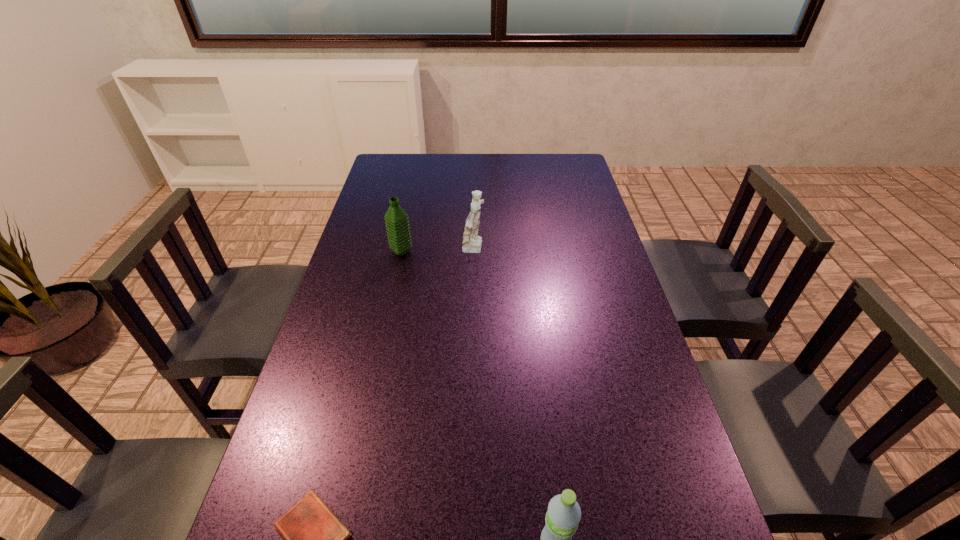
You are a GUI agent. You are given a task and a screenshot of the screen. Output one action in this format:
    pyautogui.click(x=<x>, y=<y>)
    Task: Click on the third object from left to right
    The image size is (960, 540).
    Given the screenshot: What is the action you would take?
    pyautogui.click(x=472, y=243)

Locate an element on the screen. The image size is (960, 540). the left water bottle is located at coordinates (396, 219).

Identify the location of vacant region located on the front-facing side of the second object from right to left. The width and height of the screenshot is (960, 540). (612, 250).

Where is `free space located 0.250m on the back of the left water bottle`? Image resolution: width=960 pixels, height=540 pixels. free space located 0.250m on the back of the left water bottle is located at coordinates (412, 203).

You are a GUI agent. You are given a task and a screenshot of the screen. Output one action in this format:
    pyautogui.click(x=<x>, y=<y>)
    Task: Click on the object located in the left edge section of the desktop
    This screenshot has height=540, width=960.
    Given the screenshot: What is the action you would take?
    pyautogui.click(x=396, y=219)

Find the location of a particular element. This screenshot has width=960, height=540. vacant space at the left edge is located at coordinates (356, 340).

Find the location of a particular element. The image size is (960, 540). free region at the right edge of the desktop is located at coordinates (577, 243).

Image resolution: width=960 pixels, height=540 pixels. I want to click on free spot between the figurine and the farther water bottle, so click(x=439, y=251).

Locate an element on the screen. The height and width of the screenshot is (540, 960). object that is the closest one to the figurine is located at coordinates (396, 219).

Find the location of `object that is the closest to the figurine`. object that is the closest to the figurine is located at coordinates (396, 219).